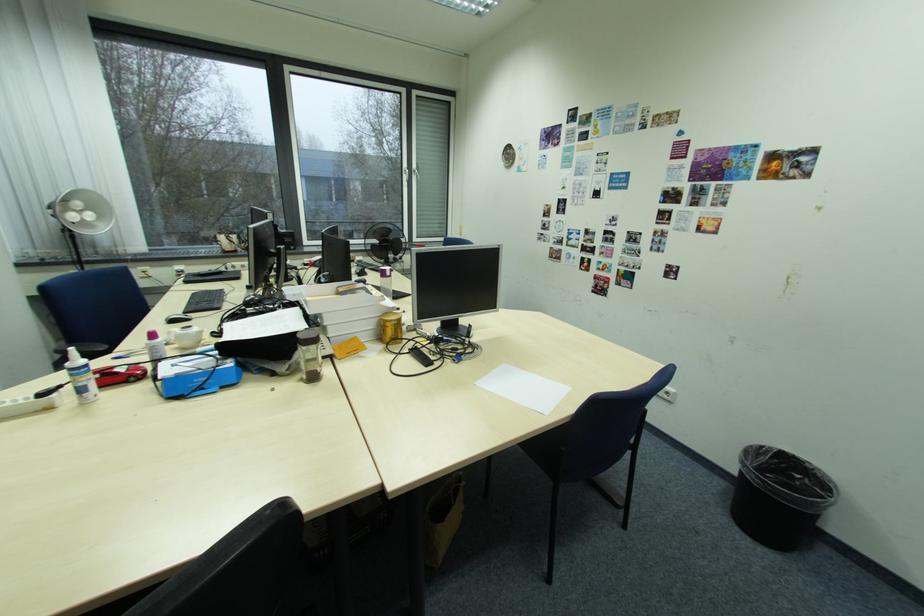
This screenshot has width=924, height=616. What do you see at coordinates (524, 387) in the screenshot?
I see `a white paper sheet` at bounding box center [524, 387].